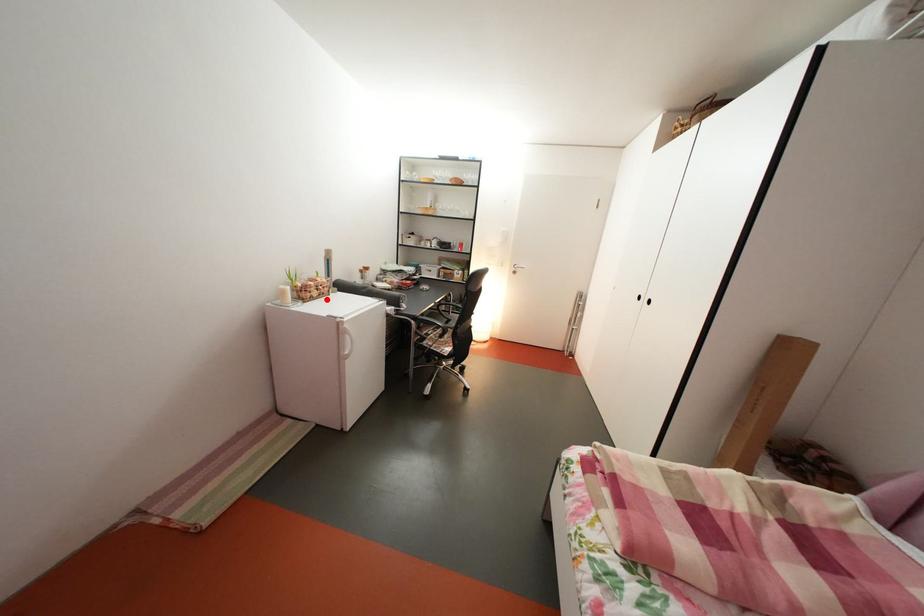
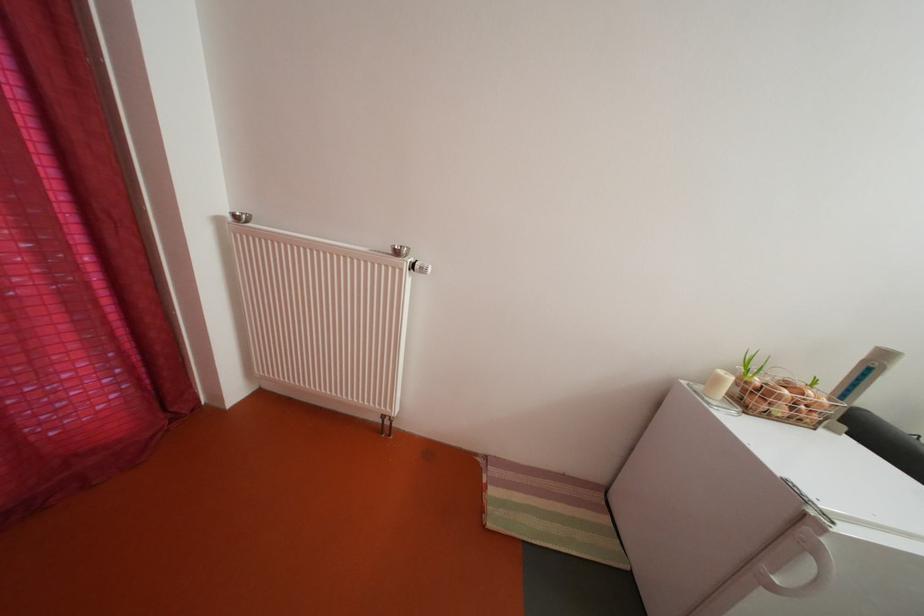
Find the pixel in the second image that matches the highlighted location in the first image.

(792, 416)